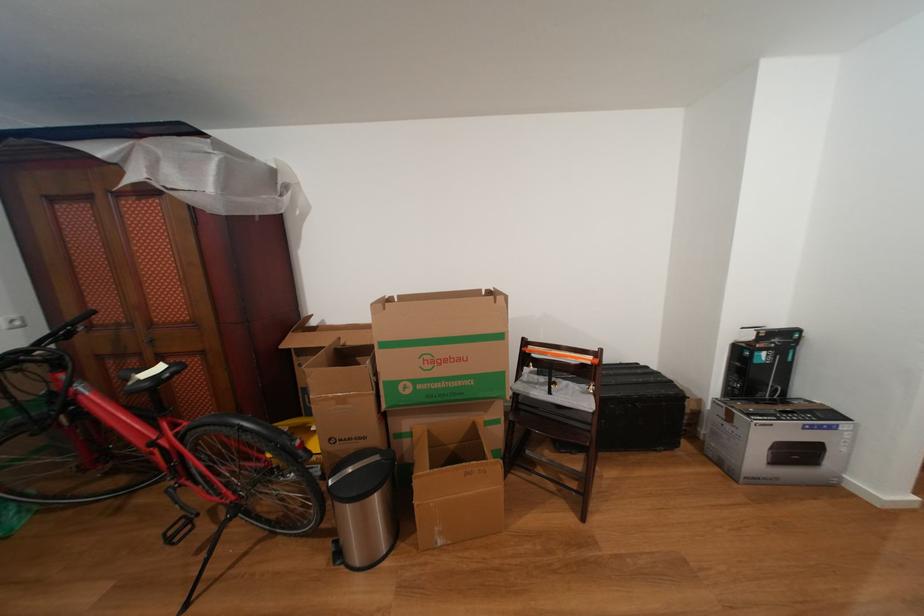
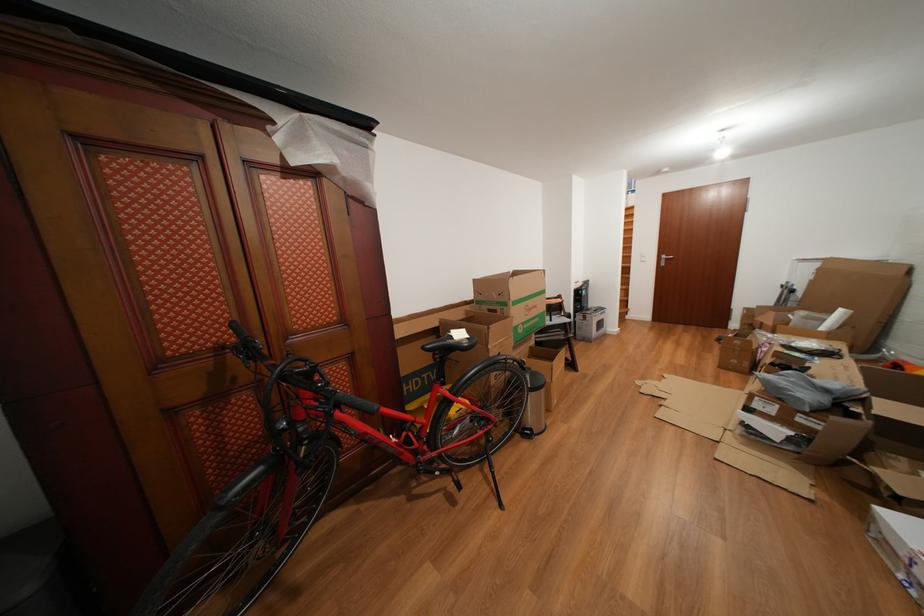
In the second image, find the point that corresponds to point 468,365 in the first image.

(543, 312)